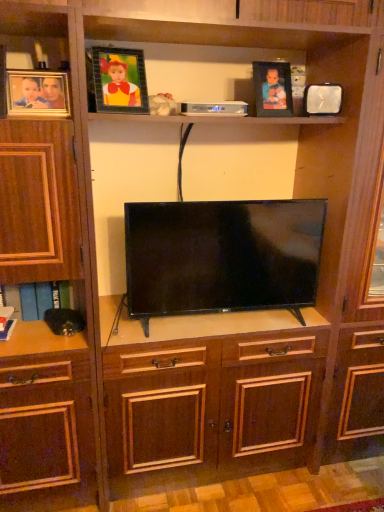
Where is `metallic silver clock at upper right, the first picture frame positioned from the right`? metallic silver clock at upper right, the first picture frame positioned from the right is located at coordinates (322, 99).

From the picture: From the image's perspective, between matte black picture frame at upper center, the second picture frame in the right-to-left sequence, and flat screen tv at center, which one is located above?

From the image's view, matte black picture frame at upper center, the second picture frame in the right-to-left sequence, is above.

Are matte black picture frame at upper center, the third picture frame positioned from the left, and flat screen tv at center making contact?

No, matte black picture frame at upper center, the third picture frame positioned from the left, is not in contact with flat screen tv at center.

From their relative heights in the image, would you say matte black picture frame at upper center, the second picture frame in the right-to-left sequence, is taller or shorter than flat screen tv at center?

Considering their sizes, matte black picture frame at upper center, the second picture frame in the right-to-left sequence, has less height than flat screen tv at center.

Locate an element on the screen. picture frame that is the 1st one when counting rightward from the flat screen tv at center is located at coordinates (272, 89).

From the picture: Considering the sizes of metallic silver clock at upper right, the first picture frame positioned from the right, and matte black picture frame at upper center, the second picture frame in the right-to-left sequence, in the image, is metallic silver clock at upper right, the first picture frame positioned from the right, wider or thinner than matte black picture frame at upper center, the second picture frame in the right-to-left sequence,?

Clearly, metallic silver clock at upper right, the first picture frame positioned from the right, has more width compared to matte black picture frame at upper center, the second picture frame in the right-to-left sequence.

Find the location of `picture frame that is the 1st one when counting leftward from the metallic silver clock at upper right, the first picture frame positioned from the right`. picture frame that is the 1st one when counting leftward from the metallic silver clock at upper right, the first picture frame positioned from the right is located at coordinates (272, 89).

Is point (334, 86) less distant than point (267, 99)?

Yes, point (334, 86) is in front of point (267, 99).

Is metallic silver clock at upper right, the first picture frame positioned from the right, looking in the opposite direction of matte black picture frame at upper center, the third picture frame positioned from the left?

metallic silver clock at upper right, the first picture frame positioned from the right, does not have its back to matte black picture frame at upper center, the third picture frame positioned from the left.

Which is behind, point (182, 215) or point (103, 49)?

The point (182, 215) is more distant.

From the image's perspective, between flat screen tv at center and metallic frame at upper center, the second picture frame positioned from the left, which one is located above?

metallic frame at upper center, the second picture frame positioned from the left, is shown above in the image.

Locate an element on the screen. This screenshot has width=384, height=512. television below the metallic frame at upper center, the third picture frame viewed from the right (from the image's perspective) is located at coordinates (222, 256).

Does flat screen tv at center have a smaller size compared to metallic frame at upper center, the third picture frame viewed from the right?

Incorrect, flat screen tv at center is not smaller in size than metallic frame at upper center, the third picture frame viewed from the right.

Between metallic frame at upper center, the second picture frame positioned from the left, and matte black picture frame at upper center, the second picture frame in the right-to-left sequence, which one appears on the left side from the viewer's perspective?

metallic frame at upper center, the second picture frame positioned from the left, is more to the left.

Looking at this image, is metallic frame at upper center, the second picture frame positioned from the left, positioned far away from matte black picture frame at upper center, the third picture frame positioned from the left?

Actually, metallic frame at upper center, the second picture frame positioned from the left, and matte black picture frame at upper center, the third picture frame positioned from the left, are a little close together.

From the image's perspective, which is above, metallic frame at upper center, the third picture frame viewed from the right, or matte black picture frame at upper center, the second picture frame in the right-to-left sequence?

matte black picture frame at upper center, the second picture frame in the right-to-left sequence, appears higher in the image.

Is point (139, 83) positioned in front of point (289, 113)?

Yes, it is.

Could you tell me if matte wooden picture frame at upper left, which ranks as the first picture frame in left-to-right order, is facing matte black picture frame at upper center, the second picture frame in the right-to-left sequence?

No.

Is matte wooden picture frame at upper left, which appears as the 4th picture frame when viewed from the right, far from matte black picture frame at upper center, the third picture frame positioned from the left?

No, matte wooden picture frame at upper left, which appears as the 4th picture frame when viewed from the right, is not far away from matte black picture frame at upper center, the third picture frame positioned from the left.

From a real-world perspective, who is located higher, matte wooden picture frame at upper left, which ranks as the first picture frame in left-to-right order, or matte black picture frame at upper center, the third picture frame positioned from the left?

In real-world perspective, matte black picture frame at upper center, the third picture frame positioned from the left, is above.

Is matte wooden picture frame at upper left, which appears as the 4th picture frame when viewed from the right, in front of matte black picture frame at upper center, the second picture frame in the right-to-left sequence?

Yes, matte wooden picture frame at upper left, which appears as the 4th picture frame when viewed from the right, is closer to the viewer.

Which is farther from the camera, (218, 294) or (55, 105)?

Positioned behind is point (218, 294).

From the image's perspective, relative to matte wooden picture frame at upper left, which ranks as the first picture frame in left-to-right order, is flat screen tv at center above or below?

From the image's perspective, flat screen tv at center appears below matte wooden picture frame at upper left, which ranks as the first picture frame in left-to-right order.

Is flat screen tv at center taller or shorter than matte wooden picture frame at upper left, which appears as the 4th picture frame when viewed from the right?

flat screen tv at center is taller than matte wooden picture frame at upper left, which appears as the 4th picture frame when viewed from the right.

Is flat screen tv at center far from matte wooden picture frame at upper left, which appears as the 4th picture frame when viewed from the right?

No, flat screen tv at center is not far away from matte wooden picture frame at upper left, which appears as the 4th picture frame when viewed from the right.

Which is further, [329,95] or [161,296]?

Point [161,296]

Which of these two, metallic silver clock at upper right, which is counted as the fourth picture frame, starting from the left, or flat screen tv at center, is wider?

flat screen tv at center.

Image resolution: width=384 pixels, height=512 pixels. Identify the location of television located in front of the matte black picture frame at upper center, the second picture frame in the right-to-left sequence. (222, 256).

Find the location of a particular element. This screenshot has width=384, height=512. the 1st picture frame located beneath the matte black picture frame at upper center, the second picture frame in the right-to-left sequence (from a real-world perspective) is located at coordinates (322, 99).

From the image, which object appears to be nearer to matte wooden picture frame at upper left, which appears as the 4th picture frame when viewed from the right, metallic silver clock at upper right, the first picture frame positioned from the right, or metallic frame at upper center, the second picture frame positioned from the left?

The object closer to matte wooden picture frame at upper left, which appears as the 4th picture frame when viewed from the right, is metallic frame at upper center, the second picture frame positioned from the left.

Based on the photo, when comparing their distances from matte wooden picture frame at upper left, which ranks as the first picture frame in left-to-right order, does matte black picture frame at upper center, the second picture frame in the right-to-left sequence, or flat screen tv at center seem closer?

flat screen tv at center is closer to matte wooden picture frame at upper left, which ranks as the first picture frame in left-to-right order.

Which object lies nearer to the anchor point metallic silver clock at upper right, the first picture frame positioned from the right, flat screen tv at center or matte black picture frame at upper center, the third picture frame positioned from the left?

The object closer to metallic silver clock at upper right, the first picture frame positioned from the right, is matte black picture frame at upper center, the third picture frame positioned from the left.

From the image, which object appears to be nearer to matte black picture frame at upper center, the second picture frame in the right-to-left sequence, metallic frame at upper center, the third picture frame viewed from the right, or metallic silver clock at upper right, which is counted as the fourth picture frame, starting from the left?

metallic silver clock at upper right, which is counted as the fourth picture frame, starting from the left, is positioned closer to the anchor matte black picture frame at upper center, the second picture frame in the right-to-left sequence.

When comparing their distances from matte wooden picture frame at upper left, which ranks as the first picture frame in left-to-right order, does flat screen tv at center or matte black picture frame at upper center, the second picture frame in the right-to-left sequence, seem further?

matte black picture frame at upper center, the second picture frame in the right-to-left sequence, lies further to matte wooden picture frame at upper left, which ranks as the first picture frame in left-to-right order, than the other object.

From the image, which object appears to be nearer to flat screen tv at center, metallic silver clock at upper right, the first picture frame positioned from the right, or metallic frame at upper center, the second picture frame positioned from the left?

metallic frame at upper center, the second picture frame positioned from the left, is closer to flat screen tv at center.

Which object lies nearer to the anchor point matte wooden picture frame at upper left, which appears as the 4th picture frame when viewed from the right, metallic frame at upper center, the third picture frame viewed from the right, or matte black picture frame at upper center, the third picture frame positioned from the left?

metallic frame at upper center, the third picture frame viewed from the right, lies closer to matte wooden picture frame at upper left, which appears as the 4th picture frame when viewed from the right, than the other object.

When comparing their distances from matte black picture frame at upper center, the third picture frame positioned from the left, does flat screen tv at center or matte wooden picture frame at upper left, which appears as the 4th picture frame when viewed from the right, seem further?

matte wooden picture frame at upper left, which appears as the 4th picture frame when viewed from the right, lies further to matte black picture frame at upper center, the third picture frame positioned from the left, than the other object.

Image resolution: width=384 pixels, height=512 pixels. Identify the location of television between matte wooden picture frame at upper left, which appears as the 4th picture frame when viewed from the right, and matte black picture frame at upper center, the second picture frame in the right-to-left sequence. (222, 256).

You are a GUI agent. You are given a task and a screenshot of the screen. Output one action in this format:
    pyautogui.click(x=<x>, y=<y>)
    Task: Click on the picture frame between metallic frame at upper center, the third picture frame viewed from the right, and metallic silver clock at upper right, which is counted as the fourth picture frame, starting from the left
    The height and width of the screenshot is (512, 384).
    Given the screenshot: What is the action you would take?
    pyautogui.click(x=272, y=89)

Locate an element on the screen. The width and height of the screenshot is (384, 512). television between metallic frame at upper center, the third picture frame viewed from the right, and metallic silver clock at upper right, the first picture frame positioned from the right is located at coordinates (222, 256).

This screenshot has height=512, width=384. I want to click on picture frame located between matte wooden picture frame at upper left, which ranks as the first picture frame in left-to-right order, and matte black picture frame at upper center, the third picture frame positioned from the left, in the left-right direction, so click(119, 80).